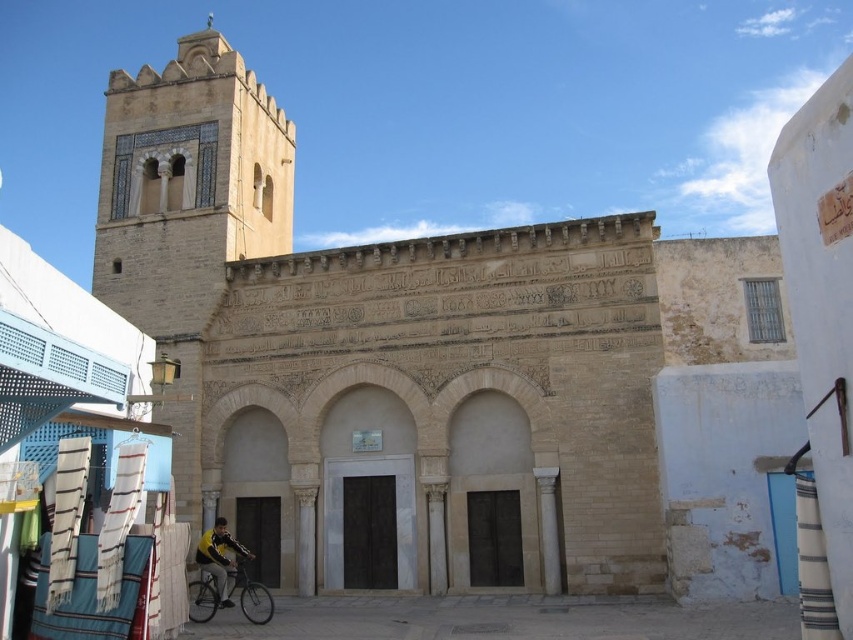
Question: Estimate the real-world distances between objects in this image. Which object is farther from the beige stone church at center?

Choices:
 (A) yellow fabric jacket at lower left
 (B) silver metallic bicycle at lower left

Answer: (A)

Question: Which of the following is the farthest from the observer?

Choices:
 (A) beige stone church at center
 (B) yellow fabric jacket at lower left
 (C) silver metallic bicycle at lower left

Answer: (B)

Question: Can you confirm if beige stone church at center is bigger than silver metallic bicycle at lower left?

Choices:
 (A) yes
 (B) no

Answer: (A)

Question: Which point is closer to the camera taking this photo?

Choices:
 (A) (235, 576)
 (B) (202, 556)

Answer: (B)

Question: Is the position of silver metallic bicycle at lower left more distant than that of yellow fabric jacket at lower left?

Choices:
 (A) no
 (B) yes

Answer: (A)

Question: Does beige stone church at center appear over yellow fabric jacket at lower left?

Choices:
 (A) no
 (B) yes

Answer: (B)